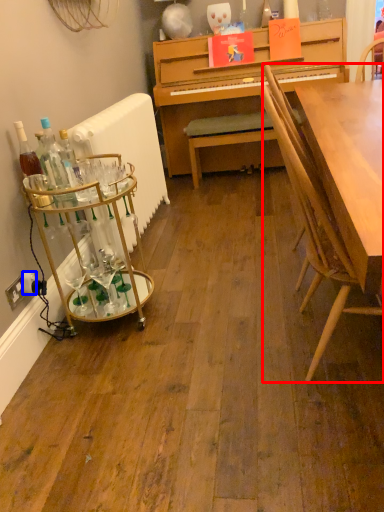
Question: Which object appears closest to the camera in this image, chair (highlighted by a red box) or power outlet (highlighted by a blue box)?

Choices:
 (A) chair
 (B) power outlet

Answer: (A)